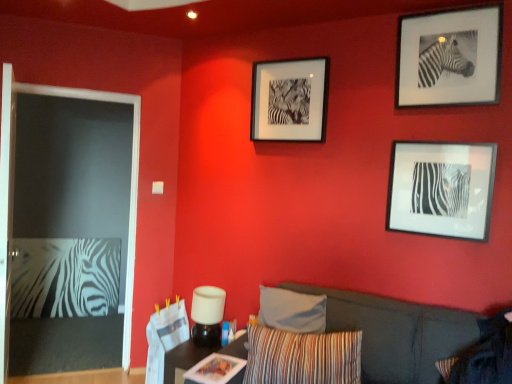
Question: Is wooden table at lower center far away from black matte picture frame at upper right, the third picture frame viewed from the left?

Choices:
 (A) yes
 (B) no

Answer: (A)

Question: Is wooden table at lower center with black matte picture frame at upper right, arranged as the first picture frame when viewed from the right?

Choices:
 (A) no
 (B) yes

Answer: (A)

Question: From a real-world perspective, is wooden table at lower center below black matte picture frame at upper right, the third picture frame viewed from the left?

Choices:
 (A) no
 (B) yes

Answer: (B)

Question: From a real-world perspective, is wooden table at lower center on black matte picture frame at upper right, the third picture frame viewed from the left?

Choices:
 (A) yes
 (B) no

Answer: (B)

Question: Can you confirm if wooden table at lower center is smaller than black matte picture frame at upper right, arranged as the first picture frame when viewed from the right?

Choices:
 (A) yes
 (B) no

Answer: (B)

Question: From their relative heights in the image, would you say black matte picture frame at center-right, which ranks as the second picture frame in right-to-left order, is taller or shorter than black matte picture frame at upper center, arranged as the first picture frame when viewed from the left?

Choices:
 (A) short
 (B) tall

Answer: (A)

Question: Considering the positions of black matte picture frame at center-right, acting as the 2th picture frame starting from the left, and black matte picture frame at upper center, arranged as the first picture frame when viewed from the left, in the image, is black matte picture frame at center-right, acting as the 2th picture frame starting from the left, bigger or smaller than black matte picture frame at upper center, arranged as the first picture frame when viewed from the left,?

Choices:
 (A) small
 (B) big

Answer: (A)

Question: From a real-world perspective, is black matte picture frame at center-right, which ranks as the second picture frame in right-to-left order, above or below black matte picture frame at upper center, acting as the third picture frame starting from the right?

Choices:
 (A) below
 (B) above

Answer: (A)

Question: Is black matte picture frame at center-right, which ranks as the second picture frame in right-to-left order, to the left or to the right of black matte picture frame at upper center, arranged as the first picture frame when viewed from the left, in the image?

Choices:
 (A) right
 (B) left

Answer: (A)

Question: Considering the positions of wooden table at lower center and striped fabric pillow at lower center, the second pillow from the right, in the image, is wooden table at lower center taller or shorter than striped fabric pillow at lower center, the second pillow from the right,?

Choices:
 (A) short
 (B) tall

Answer: (A)

Question: From the image's perspective, is wooden table at lower center positioned above or below striped fabric pillow at lower center, the second pillow from the right?

Choices:
 (A) below
 (B) above

Answer: (A)

Question: Is wooden table at lower center inside or outside of striped fabric pillow at lower center, the second pillow from the right?

Choices:
 (A) inside
 (B) outside

Answer: (B)

Question: Is wooden table at lower center in front of or behind striped fabric pillow at lower center, which appears as the 1th pillow when viewed from the left, in the image?

Choices:
 (A) front
 (B) behind

Answer: (B)

Question: Is striped fabric pillow at lower right, the second pillow when ordered from left to right, inside or outside of black matte picture frame at center-right, acting as the 2th picture frame starting from the left?

Choices:
 (A) outside
 (B) inside

Answer: (A)

Question: From the image's perspective, is striped fabric pillow at lower right, which is the first pillow in right-to-left order, above or below black matte picture frame at center-right, which ranks as the second picture frame in right-to-left order?

Choices:
 (A) above
 (B) below

Answer: (B)